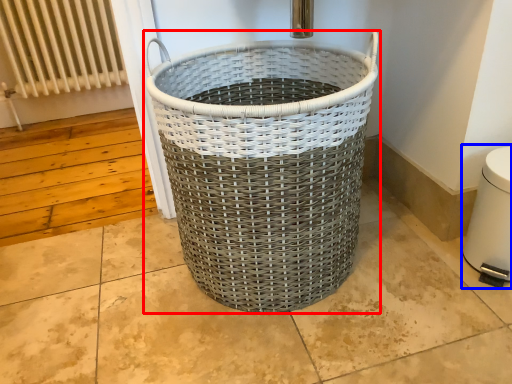
Question: Which object appears farthest to the camera in this image, waste container (highlighted by a red box) or water heater (highlighted by a blue box)?

Choices:
 (A) waste container
 (B) water heater

Answer: (B)